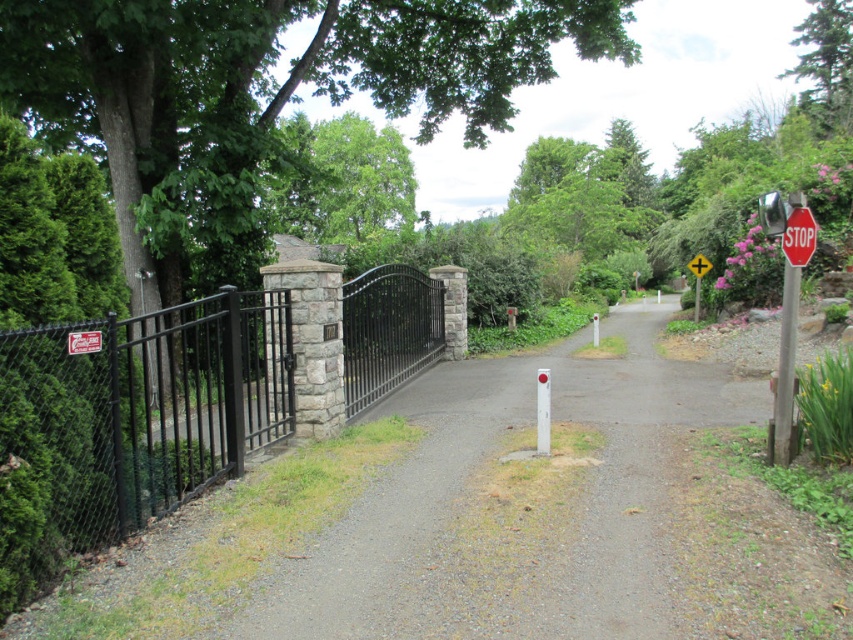
Question: Which object is the closest to the gray gravel driveway at center?

Choices:
 (A) yellow plastic sign at upper center
 (B) brushed metal sign at upper left
 (C) red metal sign at right
 (D) metallic pole at center-right

Answer: (C)

Question: Can you confirm if red metal sign at right is thinner than brushed metal sign at upper left?

Choices:
 (A) no
 (B) yes

Answer: (A)

Question: Which point is farther to the camera?

Choices:
 (A) green leafy tree at left
 (B) metallic pole at center-right
 (C) yellow plastic sign at upper center
 (D) green leafy tree at upper right

Answer: (D)

Question: From the image, what is the correct spatial relationship of red stop sign at right in relation to green leafy tree at upper right?

Choices:
 (A) left
 (B) right

Answer: (A)

Question: Is the position of green leafy tree at upper center less distant than that of yellow plastic sign at upper center?

Choices:
 (A) no
 (B) yes

Answer: (B)

Question: Which object appears farthest from the camera in this image?

Choices:
 (A) yellow plastic sign at upper center
 (B) red metal sign at right
 (C) green leafy tree at upper right

Answer: (C)